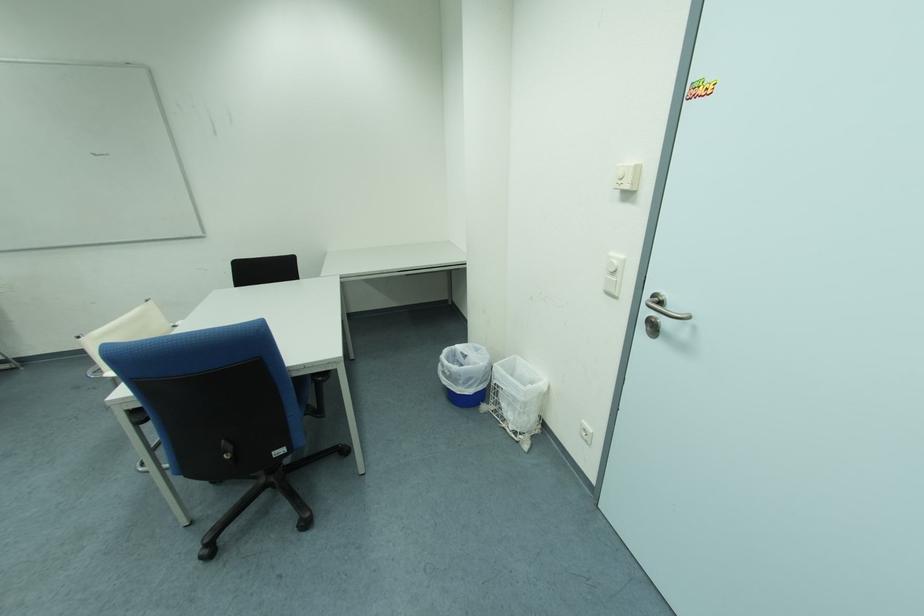
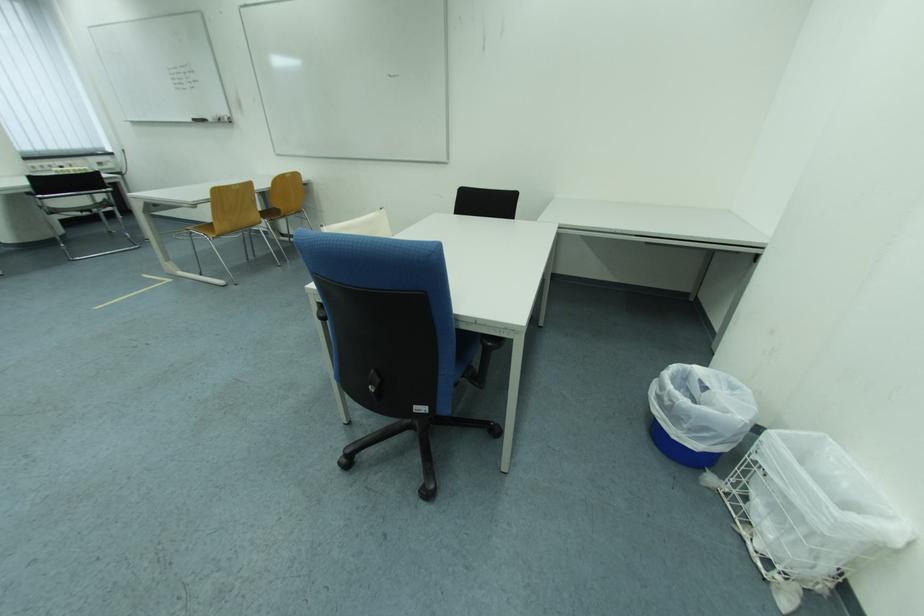
The point at (x=485, y=352) is marked in the first image. Where is the corresponding point in the second image?

(742, 390)